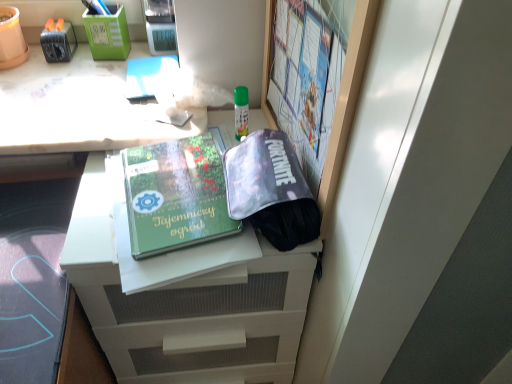
Question: Is green plastic pen holder at upper left, which is counted as the second stationery, starting from the left, thinner than green matte book at center?

Choices:
 (A) yes
 (B) no

Answer: (A)

Question: Does green plastic pen holder at upper left, which is counted as the second stationery, starting from the left, have a lesser height compared to green matte book at center?

Choices:
 (A) yes
 (B) no

Answer: (B)

Question: From a real-world perspective, does green plastic pen holder at upper left, which is counted as the second stationery, starting from the left, stand above green matte book at center?

Choices:
 (A) yes
 (B) no

Answer: (A)

Question: Is green plastic pen holder at upper left, the first stationery positioned from the right, turned away from green matte book at center?

Choices:
 (A) yes
 (B) no

Answer: (B)

Question: Is green plastic pen holder at upper left, which is counted as the second stationery, starting from the left, next to green matte book at center and touching it?

Choices:
 (A) yes
 (B) no

Answer: (B)

Question: Are green plastic pen holder at upper left, the first stationery positioned from the right, and green matte book at center far apart?

Choices:
 (A) no
 (B) yes

Answer: (A)

Question: Is white glossy desk at upper left not inside green plastic pen holder at upper left, which is counted as the second stationery, starting from the left?

Choices:
 (A) no
 (B) yes

Answer: (B)

Question: From the image's perspective, is white glossy desk at upper left under green plastic pen holder at upper left, which is counted as the second stationery, starting from the left?

Choices:
 (A) no
 (B) yes

Answer: (B)

Question: Does white glossy desk at upper left lie in front of green plastic pen holder at upper left, which is counted as the second stationery, starting from the left?

Choices:
 (A) no
 (B) yes

Answer: (B)

Question: Can you confirm if white glossy desk at upper left is smaller than green plastic pen holder at upper left, the first stationery positioned from the right?

Choices:
 (A) no
 (B) yes

Answer: (A)

Question: Is green plastic pen holder at upper left, which is counted as the second stationery, starting from the left, completely or partially inside white glossy desk at upper left?

Choices:
 (A) no
 (B) yes

Answer: (A)

Question: Does white glossy desk at upper left have a greater height compared to green plastic pen holder at upper left, which is counted as the second stationery, starting from the left?

Choices:
 (A) no
 (B) yes

Answer: (A)

Question: Is green matte book at center looking in the opposite direction of white glossy desk at upper left?

Choices:
 (A) yes
 (B) no

Answer: (A)